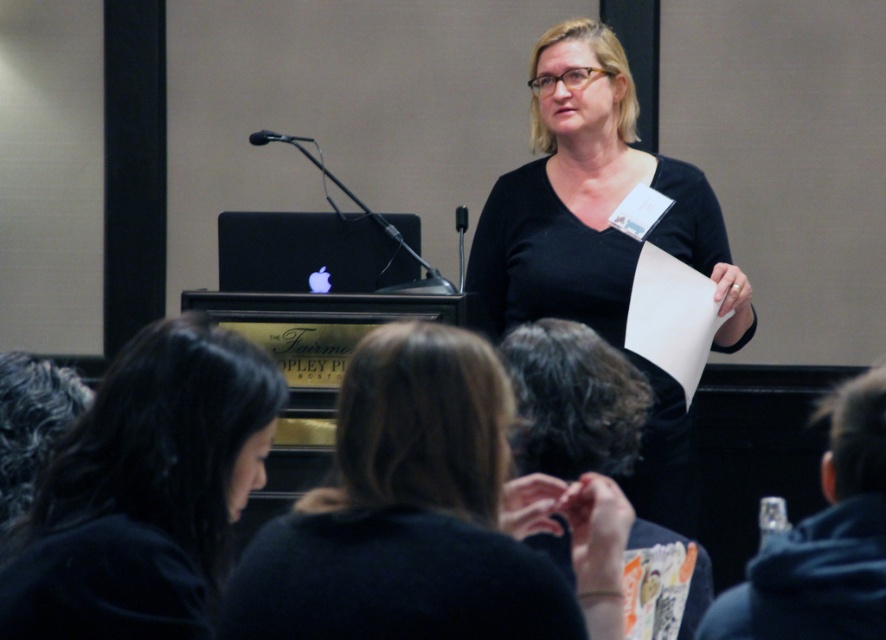
Can you confirm if dark brown hair at lower left is wider than black fabric at lower right?

Correct, the width of dark brown hair at lower left exceeds that of black fabric at lower right.

Between dark brown hair at lower left and black fabric at lower right, which one appears on the right side from the viewer's perspective?

black fabric at lower right is more to the right.

Locate an element on the screen. dark brown hair at lower left is located at coordinates (145, 492).

Can you confirm if dark brown hair at lower left is positioned below black matte shirt at center?

Yes, dark brown hair at lower left is below black matte shirt at center.

Measure the distance from dark brown hair at lower left to black matte shirt at center.

4.49 feet

Between point (145, 556) and point (556, 42), which one is positioned behind?

Positioned behind is point (556, 42).

Image resolution: width=886 pixels, height=640 pixels. I want to click on dark brown hair at lower left, so click(145, 492).

Identify the location of black fabric at lower right. (822, 540).

At what (x,y) coordinates should I click in order to perform the action: click on black fabric at lower right. Please return your answer as a coordinate pair (x, y). Looking at the image, I should click on (822, 540).